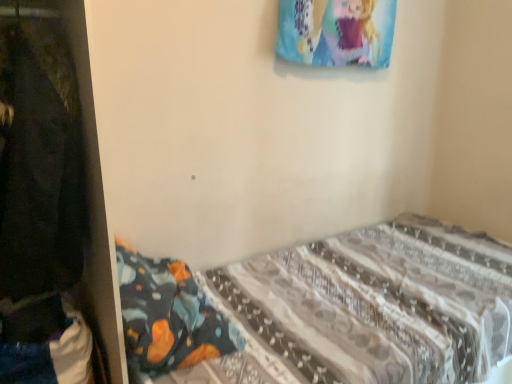
Locate an element on the screen. The image size is (512, 384). black fabric at left is located at coordinates (64, 173).

What do you see at coordinates (64, 173) in the screenshot? I see `black fabric at left` at bounding box center [64, 173].

The width and height of the screenshot is (512, 384). What do you see at coordinates (366, 308) in the screenshot?
I see `patterned fabric bed at lower right` at bounding box center [366, 308].

Where is `patterned fabric bed at lower right`? patterned fabric bed at lower right is located at coordinates (366, 308).

You are a GUI agent. You are given a task and a screenshot of the screen. Output one action in this format:
    pyautogui.click(x=<x>, y=<y>)
    Task: Click on the black fabric at left
    
    Given the screenshot: What is the action you would take?
    pyautogui.click(x=64, y=173)

Does patterned fabric bed at lower right appear on the left side of black fabric at left?

No.

Between patterned fabric bed at lower right and black fabric at left, which one is positioned behind?

patterned fabric bed at lower right is further from the camera.

Does point (350, 310) appear closer or farther from the camera than point (55, 160)?

Point (350, 310) is farther from the camera than point (55, 160).

From the image's perspective, which is above, patterned fabric bed at lower right or black fabric at left?

black fabric at left is shown above in the image.

From a real-world perspective, between patterned fabric bed at lower right and black fabric at left, who is vertically lower?

patterned fabric bed at lower right, from a real-world perspective.

Between patterned fabric bed at lower right and black fabric at left, which one has larger width?

patterned fabric bed at lower right is wider.

Considering the sizes of patterned fabric bed at lower right and black fabric at left in the image, is patterned fabric bed at lower right taller or shorter than black fabric at left?

Considering their sizes, patterned fabric bed at lower right has less height than black fabric at left.

Is patterned fabric bed at lower right bigger than black fabric at left?

Correct, patterned fabric bed at lower right is larger in size than black fabric at left.

Is patterned fabric bed at lower right located outside black fabric at left?

patterned fabric bed at lower right lies outside black fabric at left's area.

Is patterned fabric bed at lower right far away from black fabric at left?

No, patterned fabric bed at lower right is in close proximity to black fabric at left.

Is patterned fabric bed at lower right turned away from black fabric at left?

patterned fabric bed at lower right does not have its back to black fabric at left.

How far apart are patterned fabric bed at lower right and black fabric at left?

The distance of patterned fabric bed at lower right from black fabric at left is 26.69 inches.

Locate an element on the screen. closet above the patterned fabric bed at lower right (from the image's perspective) is located at coordinates (64, 173).

Based on the photo, which is more to the left, black fabric at left or patterned fabric bed at lower right?

black fabric at left.

Which object is further away from the camera taking this photo, black fabric at left or patterned fabric bed at lower right?

Positioned behind is patterned fabric bed at lower right.

Which is nearer, (38, 282) or (236, 382)?

Point (38, 282) is closer to the camera than point (236, 382).

From the image's perspective, which is above, black fabric at left or patterned fabric bed at lower right?

black fabric at left appears higher in the image.

From a real-world perspective, between black fabric at left and patterned fabric bed at lower right, who is vertically higher?

In real-world perspective, black fabric at left is above.

Can you confirm if black fabric at left is wider than patterned fabric bed at lower right?

Incorrect, the width of black fabric at left does not surpass that of patterned fabric bed at lower right.

Which of these two, black fabric at left or patterned fabric bed at lower right, stands shorter?

patterned fabric bed at lower right is shorter.

Who is smaller, black fabric at left or patterned fabric bed at lower right?

black fabric at left.

Is black fabric at left inside the boundaries of patterned fabric bed at lower right, or outside?

black fabric at left is outside patterned fabric bed at lower right.

Are black fabric at left and patterned fabric bed at lower right located far from each other?

No, black fabric at left is in close proximity to patterned fabric bed at lower right.

Does black fabric at left turn towards patterned fabric bed at lower right?

No, black fabric at left is not turned towards patterned fabric bed at lower right.

Identify the location of bed on the right of black fabric at left. (366, 308).

Find the location of `bed located behind the black fabric at left`. bed located behind the black fabric at left is located at coordinates (366, 308).

At what (x,y) coordinates should I click in order to perform the action: click on closet lying above the patterned fabric bed at lower right (from the image's perspective). Please return your answer as a coordinate pair (x, y). Looking at the image, I should click on (64, 173).